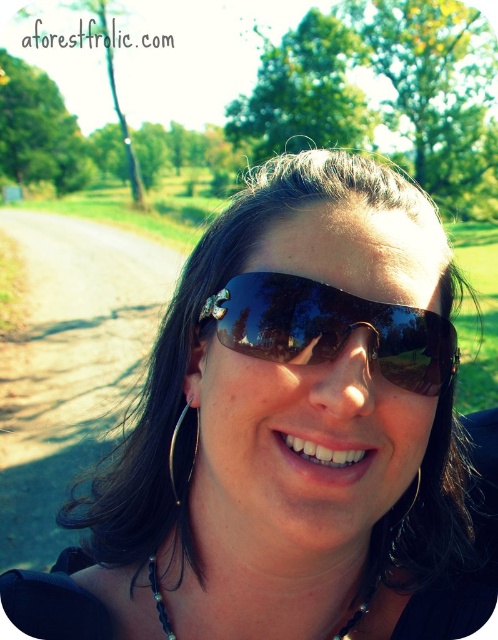
You are trying to decide whether to wear the shiny black goggles at center or the black beaded necklace at center for a casual day out. Based on their sizes, which one might be easier to pair with a variety of outfits?

The shiny black goggles at center has a lesser width compared to the black beaded necklace at center, so it might be easier to pair with a variety of outfits due to its smaller size.

You are a photographer trying to focus on the point at coordinates point (x=331, y=328) in the image. According to the scene, where is this point located?

The point (x=331, y=328) is located on shiny black goggles at center.